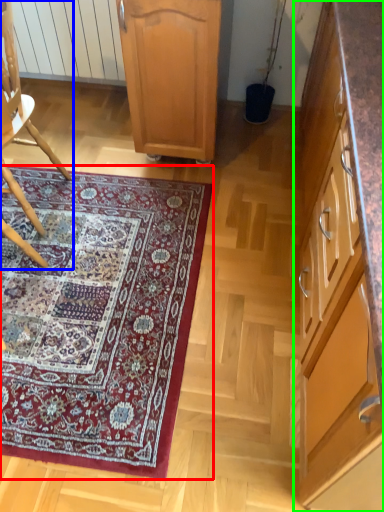
Question: Which is nearer to the mat (highlighted by a red box)? chair (highlighted by a blue box) or cabinetry (highlighted by a green box).

Choices:
 (A) chair
 (B) cabinetry

Answer: (A)